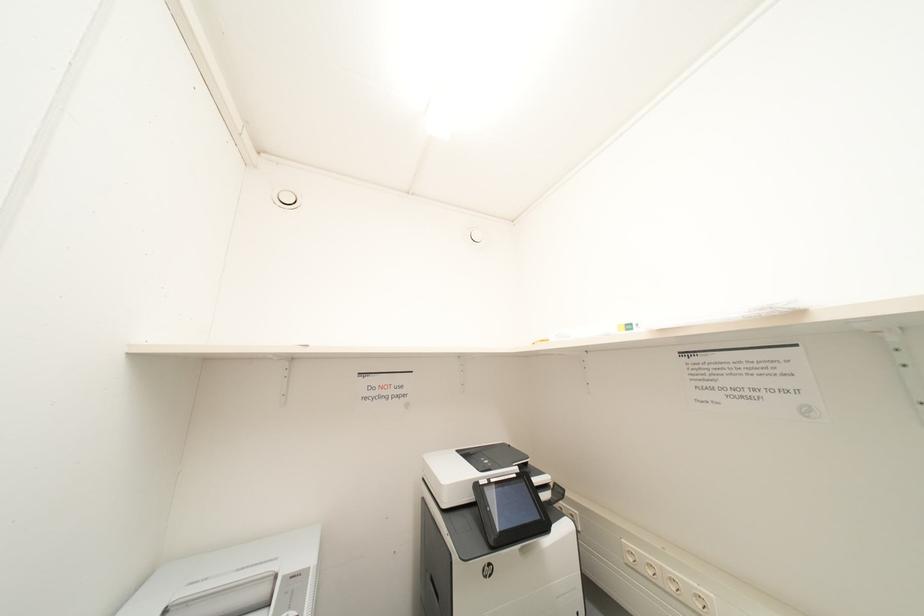
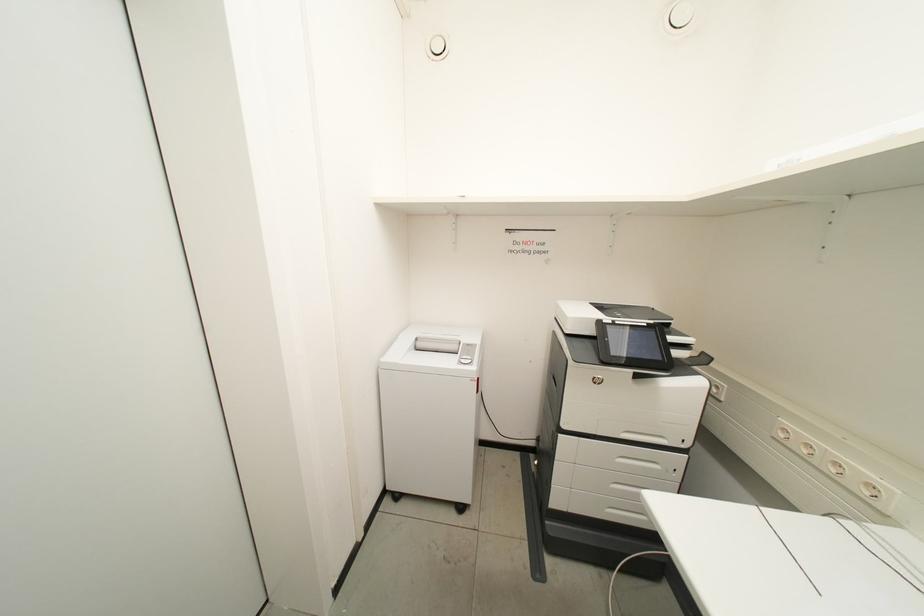
First-person continuous shooting, in which direction is the camera rotating?

The rotation direction of the camera is left-down.